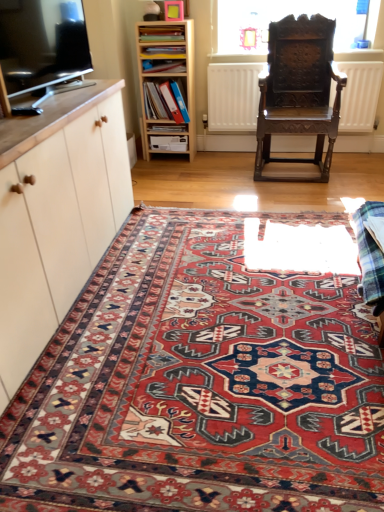
Find the location of a particular element. This screenshot has height=512, width=384. vacant space in front of white matte radiator at center is located at coordinates pyautogui.click(x=284, y=185).